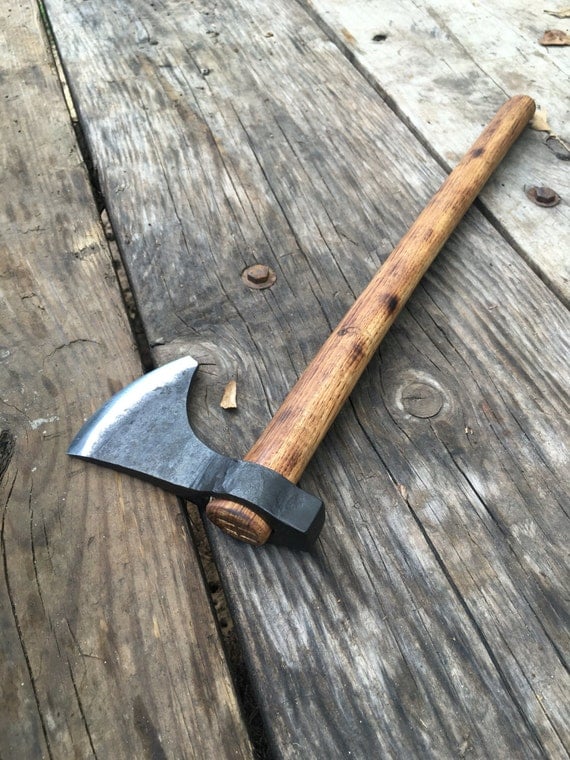
This screenshot has width=570, height=760. What are the coordinates of `the left wood plank` in the screenshot? It's located at (69, 252).